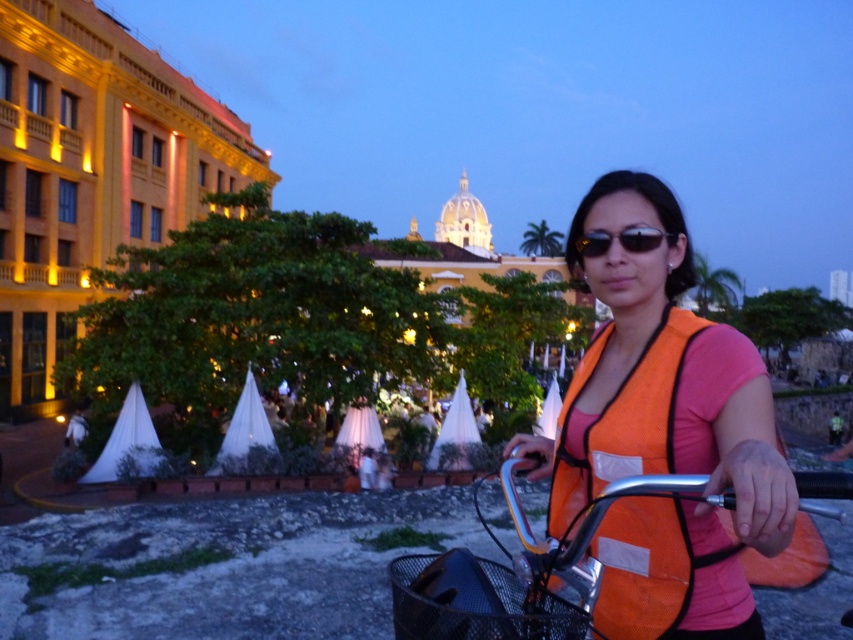
You are a city planner analyzing this image. You need to determine the exact coordinates of the orange mesh vest at center. What are its coordinates?

The orange mesh vest at center is located at coordinates point (660, 380).

Consider the image. You are a delivery person who needs to pick up a package from a locker located at point (660, 380). The locker is surrounded by a orange mesh vest at center. Can you safely reach the locker without stepping on the orange mesh vest at center?

The orange mesh vest at center is located exactly at point (660, 380) where the locker is, so you cannot safely reach the locker without stepping on the orange mesh vest at center.